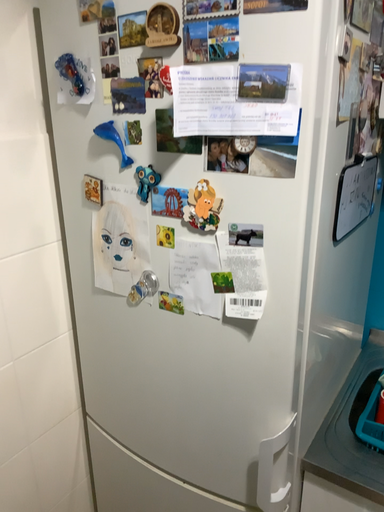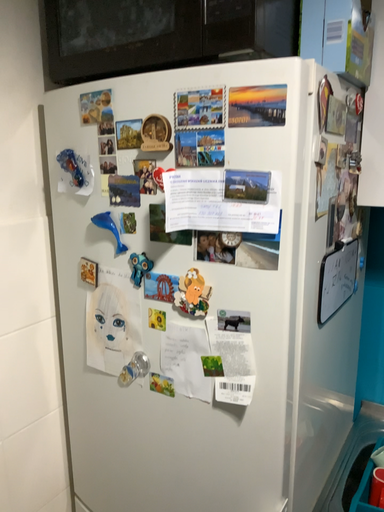
Question: How did the camera likely rotate when shooting the video?

Choices:
 (A) rotated downward
 (B) rotated upward

Answer: (B)